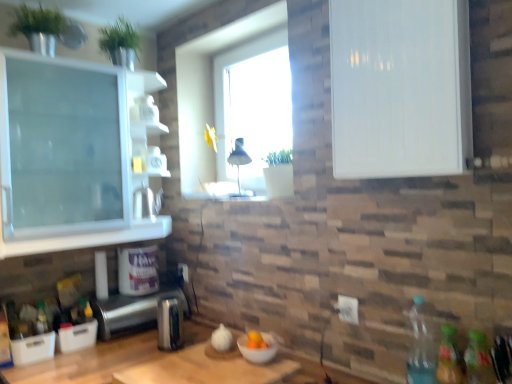
Question: From a real-world perspective, is satin silver toaster at lower left, which is the 2th appliance from back to front, positioned above or below transparent glass window at center?

Choices:
 (A) below
 (B) above

Answer: (A)

Question: Choose the correct answer: Is satin silver toaster at lower left, which is the 2th appliance from back to front, inside transparent glass window at center or outside it?

Choices:
 (A) inside
 (B) outside

Answer: (B)

Question: Which is farther from the white plastic container at lower left, acting as the third appliance starting from the front?

Choices:
 (A) translucent glass jar at upper center
 (B) white glossy cabinet at upper right
 (C) satin silver toaster at lower center, which is the 3th appliance in back-to-front order
 (D) clear plastic bottle at lower right, which appears as the third bottle when viewed from the right
 (E) translucent plastic bottle at lower left, which ranks as the first bottle in back-to-front order

Answer: (B)

Question: Which is farther from the translucent plastic bottle at lower right, acting as the fourth bottle starting from the left?

Choices:
 (A) wooden cutting board at center
 (B) translucent glass jar at upper center
 (C) translucent plastic bottle at lower left, which ranks as the first bottle in back-to-front order
 (D) translucent plastic bottle at lower right, which is the 2th bottle from front to back
 (E) clear plastic bottle at lower right, the 2th bottle from the back

Answer: (C)